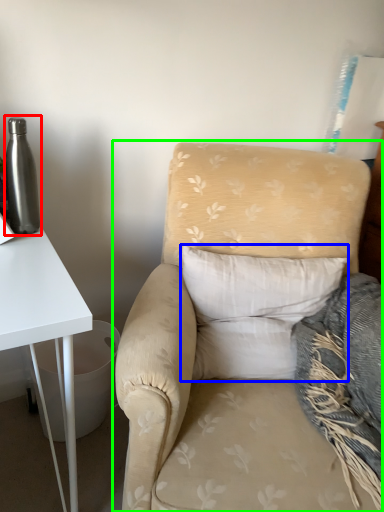
Question: Estimate the real-world distances between objects in this image. Which object is closer to bottle (highlighted by a red box), pillow (highlighted by a blue box) or chair (highlighted by a green box)?

Choices:
 (A) pillow
 (B) chair

Answer: (B)